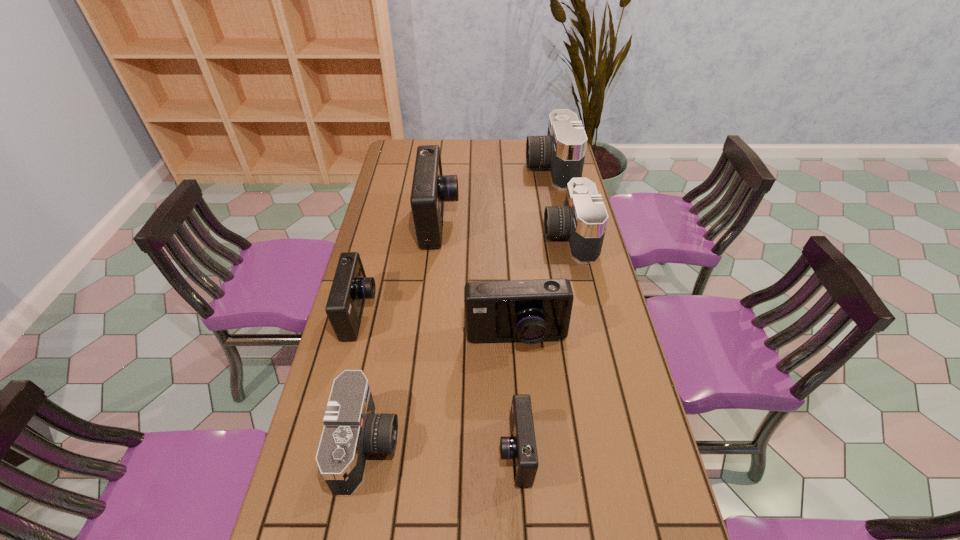
Identify which black camera is the second nearest to the nearest blue camera. Please provide its 2D coordinates. Your answer should be formatted as a tuple, i.e. [(x, y)], where the tuple contains the x and y coordinates of a point satisfying the conditions above.

[(583, 220)]

Where is `black camera identified as the second closest to the second farthest black camera`? Image resolution: width=960 pixels, height=540 pixels. black camera identified as the second closest to the second farthest black camera is located at coordinates (352, 429).

Where is `blank area in the image that satisfies the following two spatial constraints: 1. on the front-facing side of the second biggest blue camera; 2. on the front-facing side of the leftmost black camera`? Image resolution: width=960 pixels, height=540 pixels. blank area in the image that satisfies the following two spatial constraints: 1. on the front-facing side of the second biggest blue camera; 2. on the front-facing side of the leftmost black camera is located at coordinates (523, 444).